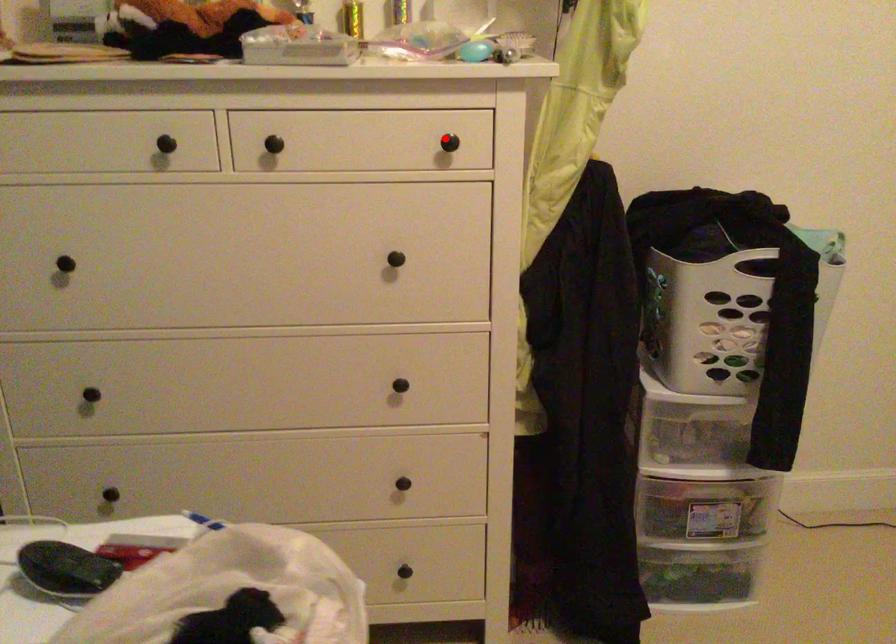
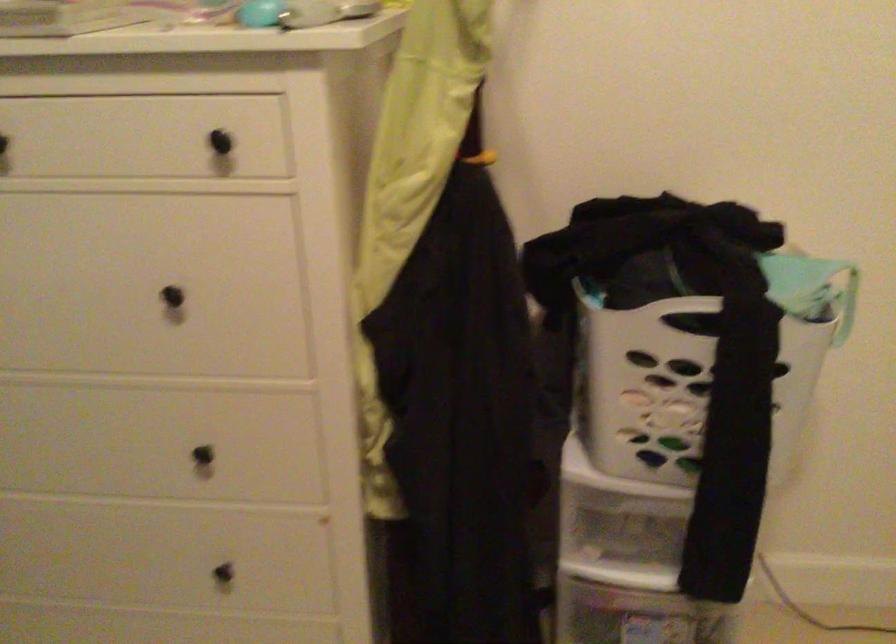
Question: I am providing you with two images of the same scene from different viewpoints. Image1 has a red point marked. In image2, the corresponding 3D location appears at what relative position? Reply with the corresponding letter.

Choices:
 (A) Closer
 (B) Farther

Answer: (A)